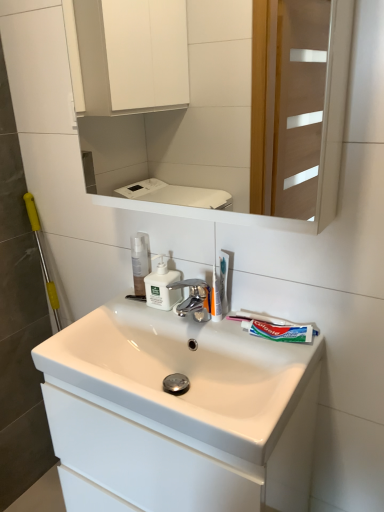
Locate an element on the screen. Image resolution: width=384 pixels, height=512 pixels. vacant space underneath white matte cabinet at upper center (from a real-world perspective) is located at coordinates (216, 328).